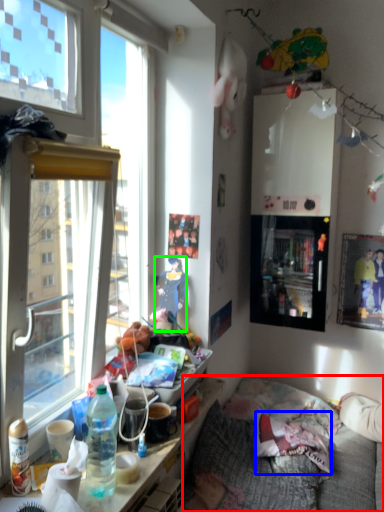
Question: Which object is the closest to the studio couch (highlighted by a red box)? Choose among these: pillow (highlighted by a blue box) or person (highlighted by a green box).

Choices:
 (A) pillow
 (B) person

Answer: (A)